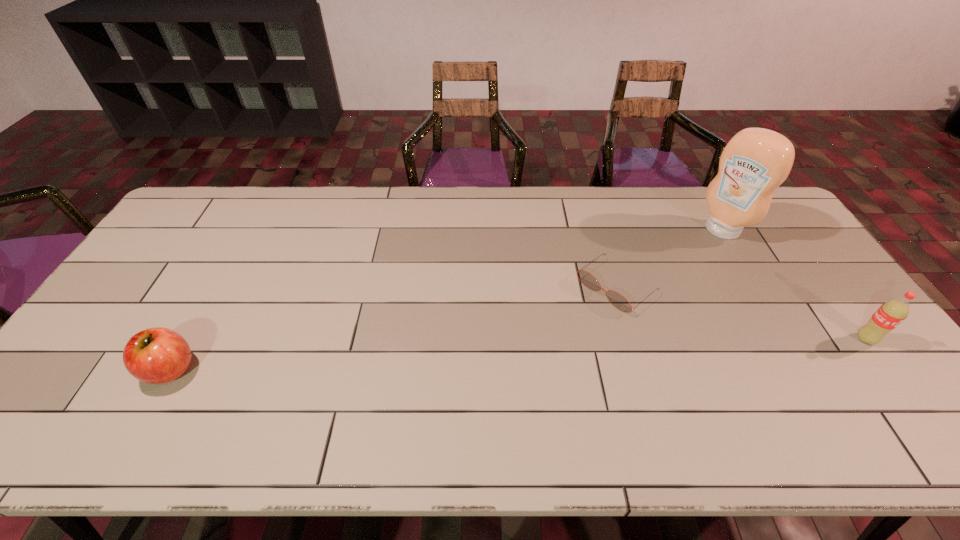
Identify the location of apple. The width and height of the screenshot is (960, 540). (158, 355).

Find the location of `the second shortest object`. the second shortest object is located at coordinates (158, 355).

You are a GUI agent. You are given a task and a screenshot of the screen. Output one action in this format:
    pyautogui.click(x=<x>, y=<y>)
    Task: Click on the rightmost object
    Image resolution: width=960 pixels, height=540 pixels.
    Given the screenshot: What is the action you would take?
    pyautogui.click(x=890, y=314)

Identify the location of soda. This screenshot has height=540, width=960. coord(890,314).

You are a GUI agent. You are given a task and a screenshot of the screen. Output one action in this format:
    pyautogui.click(x=<x>, y=<y>)
    Task: Click on the second object from right to left
    
    Given the screenshot: What is the action you would take?
    pyautogui.click(x=756, y=161)

Find the location of a particular element. This screenshot has height=540, width=960. the tallest object is located at coordinates (756, 161).

At what (x,y) coordinates should I click in order to perform the action: click on the third nearest object. Please return your answer as a coordinate pair (x, y). This screenshot has height=540, width=960. Looking at the image, I should click on (617, 300).

Image resolution: width=960 pixels, height=540 pixels. I want to click on sunglasses, so click(x=617, y=300).

The width and height of the screenshot is (960, 540). What are the coordinates of `free location located 0.080m on the back of the apple` in the screenshot? It's located at (197, 323).

The height and width of the screenshot is (540, 960). What are the coordinates of `free space located on the back of the second tallest object` in the screenshot? It's located at (822, 280).